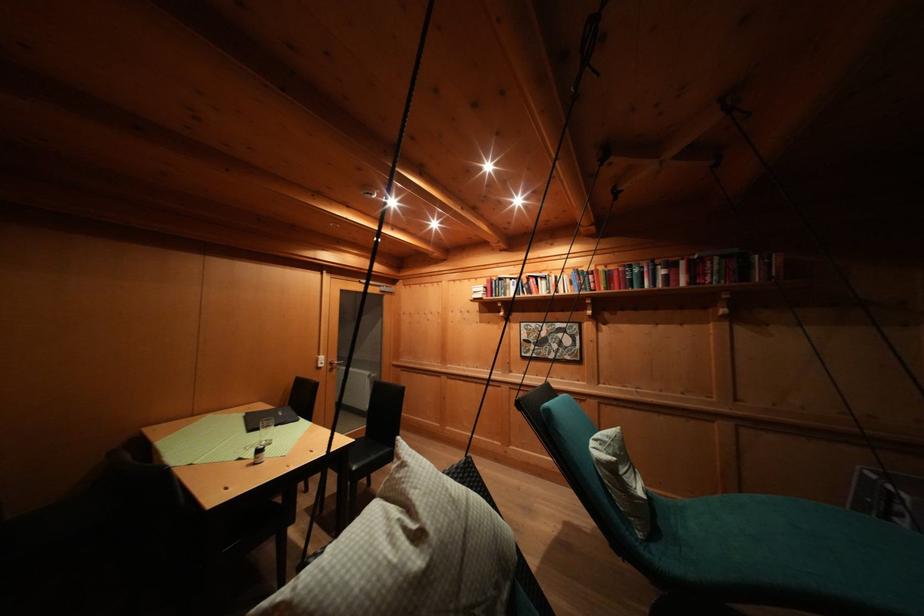
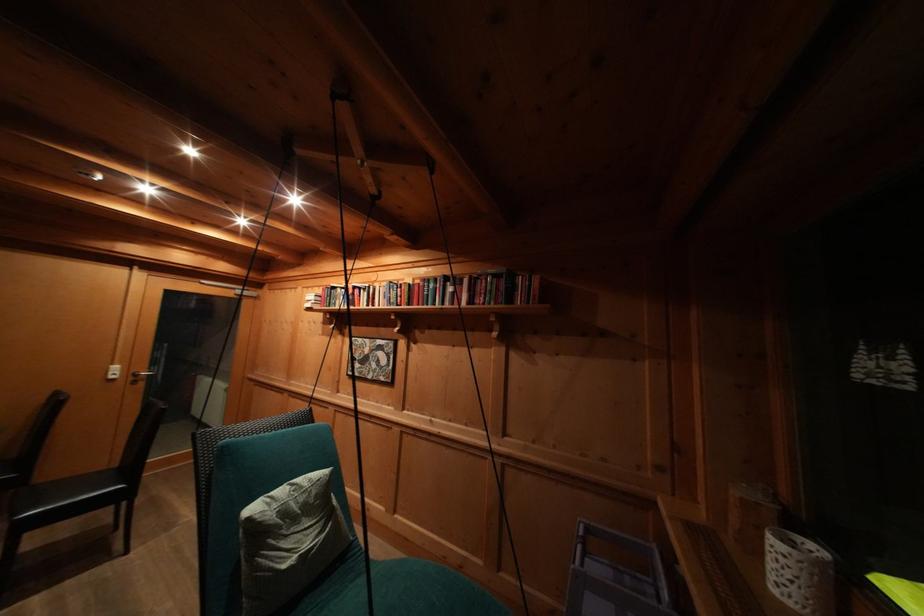
Question: The images are taken continuously from a first-person perspective. In which direction are you moving?

Choices:
 (A) Left
 (B) Right
 (C) Forward
 (D) Backward

Answer: (B)